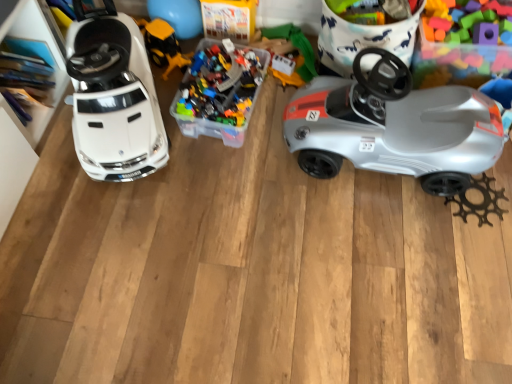
Question: Relative to translucent plastic container at center, positioned as the 3th toy in left-to-right order, is silver plastic car at right in front or behind?

Choices:
 (A) front
 (B) behind

Answer: (A)

Question: Visually, is silver plastic car at right positioned to the left or to the right of translucent plastic container at center, arranged as the 2th toy when viewed from the right?

Choices:
 (A) right
 (B) left

Answer: (A)

Question: Estimate the real-world distances between objects in this image. Which object is farther from the translucent plastic container at center, positioned as the 3th toy in left-to-right order?

Choices:
 (A) white glossy car at left, the 4th toy viewed from the right
 (B) translucent plastic blocks at upper right, positioned as the 1th toy in right-to-left order
 (C) silver plastic car at right
 (D) yellow plastic construction vehicle at center, which ranks as the 2th toy in left-to-right order

Answer: (B)

Question: Which object is positioned closest to the yellow plastic construction vehicle at center, positioned as the third toy in right-to-left order?

Choices:
 (A) silver plastic car at right
 (B) white glossy car at left, the 1th toy from the left
 (C) translucent plastic container at center, arranged as the 2th toy when viewed from the right
 (D) translucent plastic blocks at upper right, the fourth toy in the left-to-right sequence

Answer: (C)